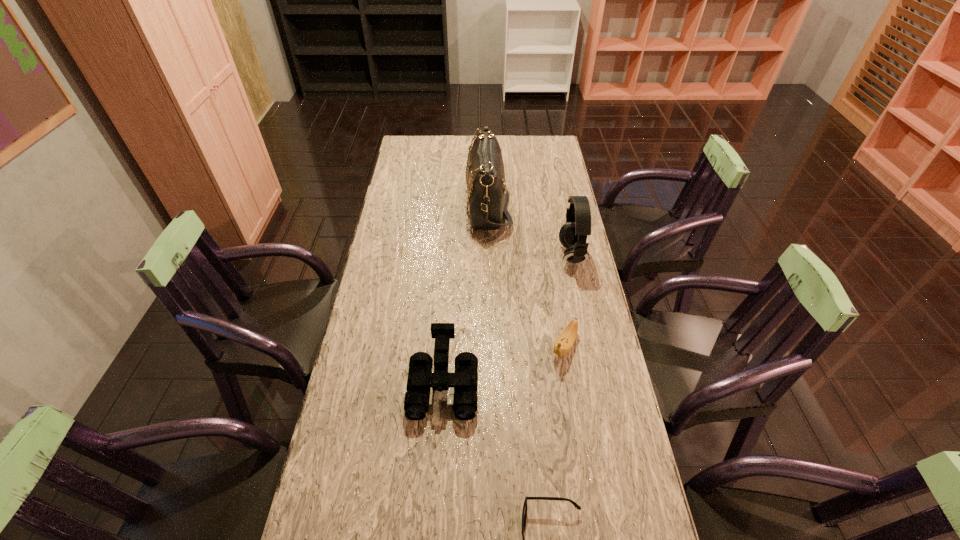
Where is `handbag`? This screenshot has width=960, height=540. handbag is located at coordinates (488, 197).

This screenshot has height=540, width=960. Find the location of `earphone`. earphone is located at coordinates (573, 234).

Find the location of a particular element. This screenshot has height=540, width=960. the third tallest object is located at coordinates (420, 379).

Image resolution: width=960 pixels, height=540 pixels. Find the location of `the fourth tallest object`. the fourth tallest object is located at coordinates (565, 341).

At what (x,y) coordinates should I click in order to perform the action: click on free location located 0.240m at the front of the handbag with chain and zipper. Please return your answer as a coordinate pair (x, y). Looking at the image, I should click on (407, 205).

In order to click on free region located at the front of the handbag with chain and zipper in this screenshot , I will do `click(393, 205)`.

The height and width of the screenshot is (540, 960). I want to click on vacant space located at the front of the handbag with chain and zipper, so click(x=421, y=205).

Where is `blank space located on the ear cups of the second tallest object`? blank space located on the ear cups of the second tallest object is located at coordinates (545, 255).

Where is `blank area located on the ear cups of the second tallest object`? blank area located on the ear cups of the second tallest object is located at coordinates (513, 255).

The image size is (960, 540). In order to click on free space located on the ear cups of the second tallest object in this screenshot , I will do `click(488, 255)`.